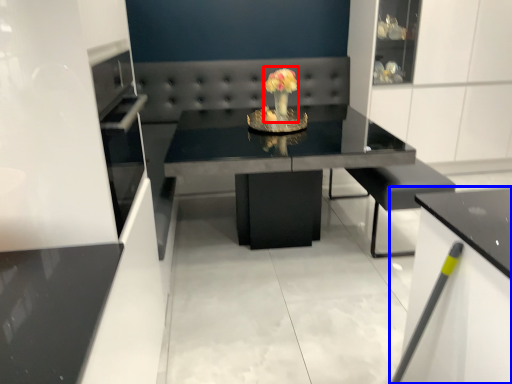
Question: Which point is further to the camera, floral arrangement (highlighted by a red box) or cabinetry (highlighted by a blue box)?

Choices:
 (A) floral arrangement
 (B) cabinetry

Answer: (A)